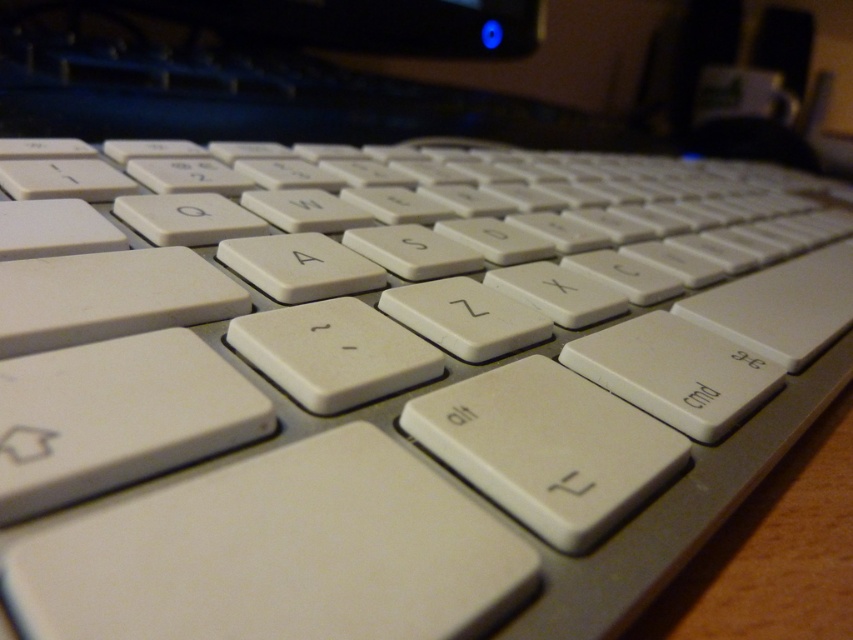
Is white plastic keyboard at upper center to the right of white matte keyboard at right from the viewer's perspective?

Incorrect, white plastic keyboard at upper center is not on the right side of white matte keyboard at right.

Is white plastic keyboard at upper center wider than white matte keyboard at right?

Yes, white plastic keyboard at upper center is wider than white matte keyboard at right.

Find the location of `white plastic keyboard at upper center`. white plastic keyboard at upper center is located at coordinates (248, 67).